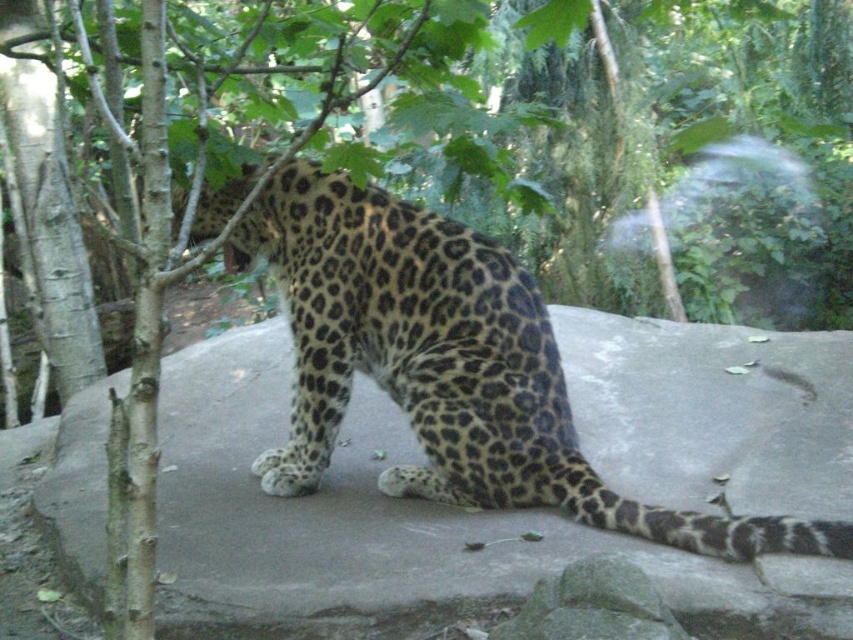
You are a zookeeper who needs to clean the leopard enclosure. You are standing 2 meters away from the gray concrete boulder at center. Can you safely approach the boulder without entering the leopard enclosure area?

The gray concrete boulder at center is 2.52 meters away from the viewer. Since you are already 2 meters away, you can approach the boulder by moving 0.52 meters closer without entering the leopard enclosure area.

You are a zookeeper observing the leopard in its enclosure. You notice the gray concrete boulder at center and the spotted fur leopard at center. Which object is closer to you?

The gray concrete boulder at center is closer to the viewer than the spotted fur leopard at center.